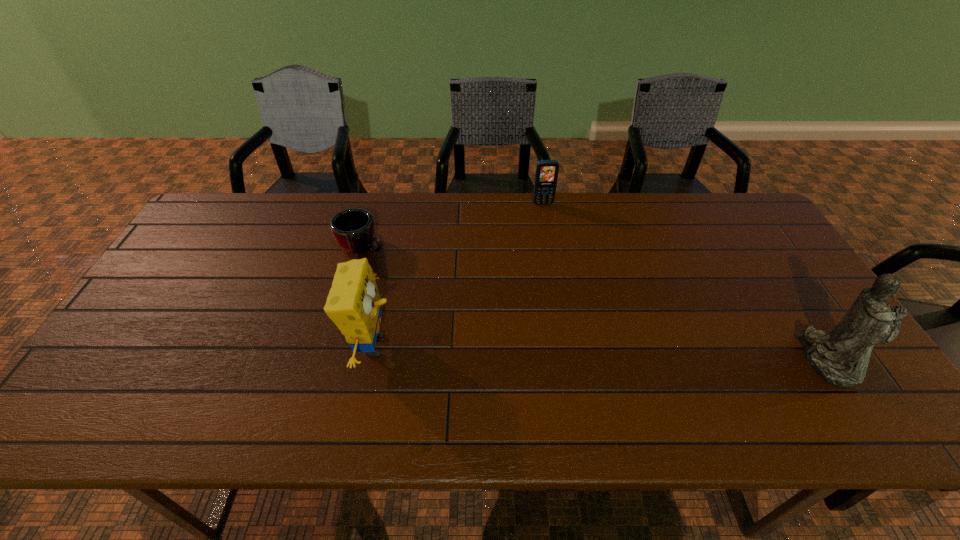
This screenshot has width=960, height=540. What are the coordinates of `free spot between the second object from right to left and the shortest object` in the screenshot? It's located at (452, 225).

Where is `free space between the mug and the farthest object`? free space between the mug and the farthest object is located at coordinates (452, 225).

What are the coordinates of `free area in between the rightmost object and the sponge` in the screenshot? It's located at (600, 353).

Identify the location of object that is the second closest to the second shortest object. (354, 305).

Identify which object is the nearest to the second tallest object. Please provide its 2D coordinates. Your answer should be formatted as a tuple, i.e. [(x, y)], where the tuple contains the x and y coordinates of a point satisfying the conditions above.

[(353, 229)]

Where is `free region that satisfies the following two spatial constraints: 1. on the front side of the farthest object; 2. on the front-facing side of the tallest object`? The width and height of the screenshot is (960, 540). free region that satisfies the following two spatial constraints: 1. on the front side of the farthest object; 2. on the front-facing side of the tallest object is located at coordinates (569, 361).